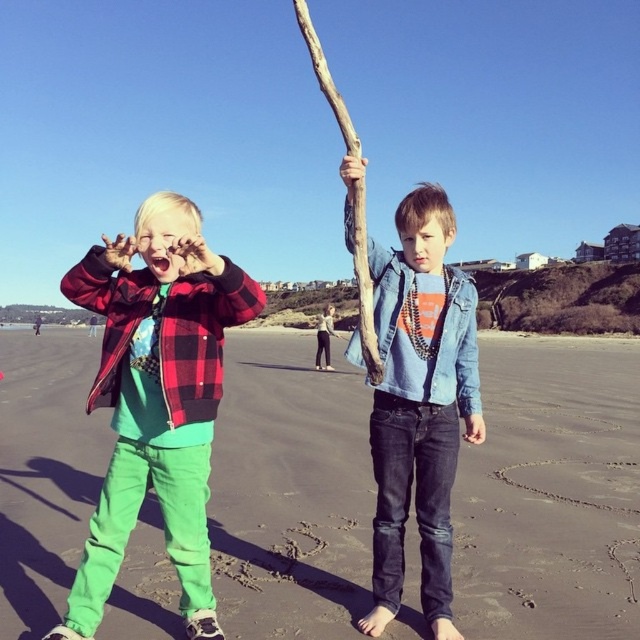
Find the location of a particular element. This screenshot has height=640, width=640. green fabric pants at left is located at coordinates (552, 493).

Image resolution: width=640 pixels, height=640 pixels. Describe the element at coordinates (552, 493) in the screenshot. I see `green fabric pants at left` at that location.

What do you see at coordinates (552, 493) in the screenshot?
I see `green fabric pants at left` at bounding box center [552, 493].

Image resolution: width=640 pixels, height=640 pixels. Identify the location of green fabric pants at left. (552, 493).

Does point (193, 264) come closer to viewer compared to point (452, 369)?

Yes, point (193, 264) is in front of point (452, 369).

This screenshot has width=640, height=640. What do you see at coordinates (156, 397) in the screenshot? I see `matte plaid jacket at left` at bounding box center [156, 397].

Locate an element on the screen. This screenshot has height=640, width=640. matte plaid jacket at left is located at coordinates (156, 397).

Who is higher up, matte plaid jacket at left or brown rough branch at center?

brown rough branch at center

Does matte plaid jacket at left have a greater height compared to brown rough branch at center?

Incorrect, matte plaid jacket at left's height is not larger of brown rough branch at center's.

Is point (221, 262) positioned after point (321, 61)?

That is False.

The width and height of the screenshot is (640, 640). What are the coordinates of `matte plaid jacket at left` in the screenshot? It's located at (156, 397).